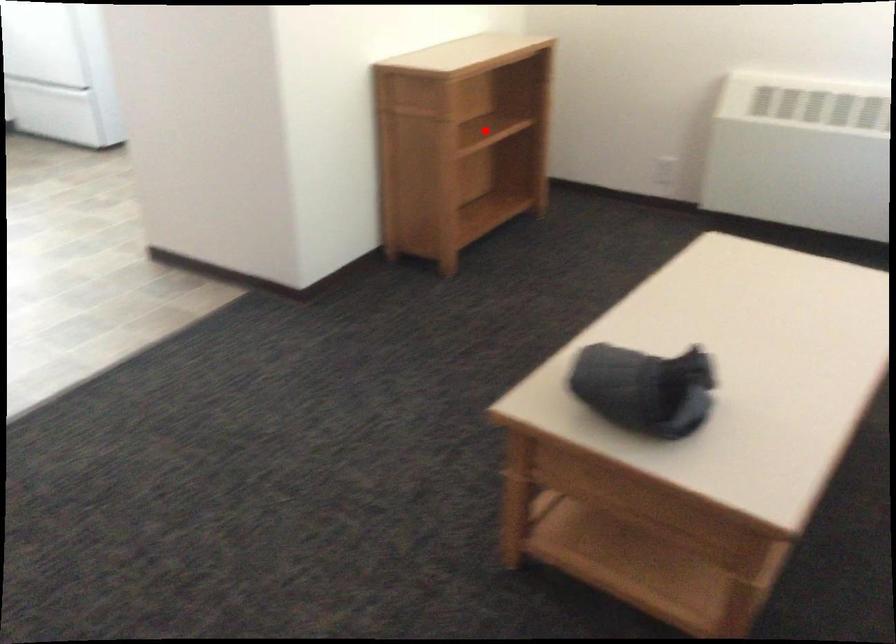
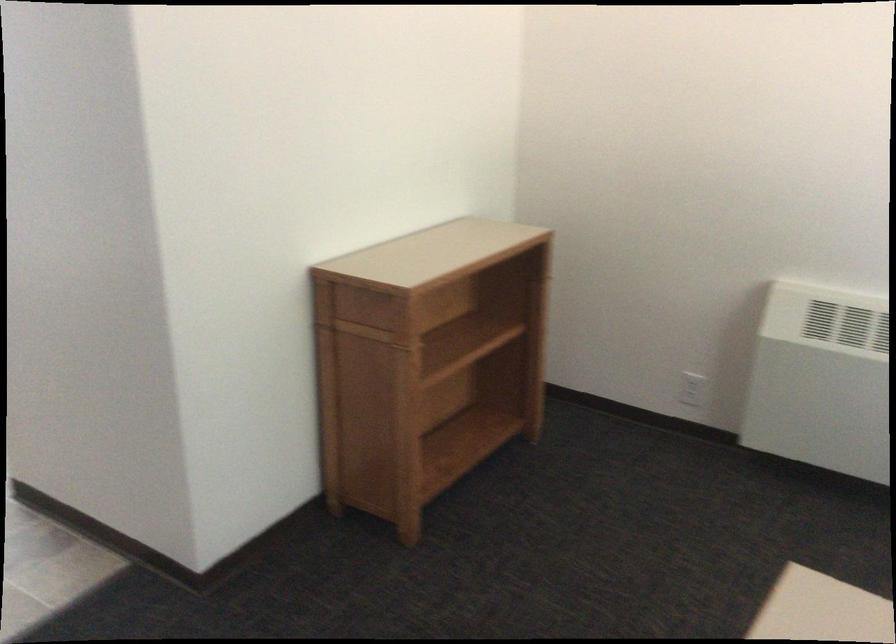
Find the pixel in the second image that matches the highlighted location in the first image.

(462, 345)